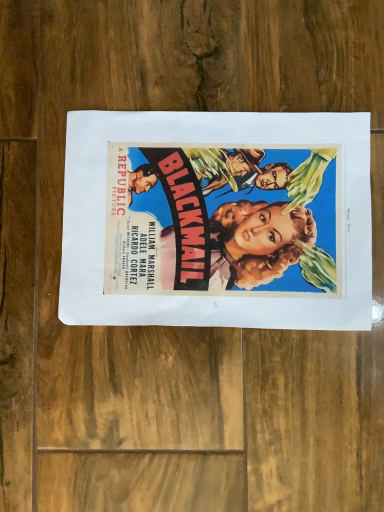
Question: Should I look upward or downward to see matte paper poster at center?

Choices:
 (A) up
 (B) down

Answer: (A)